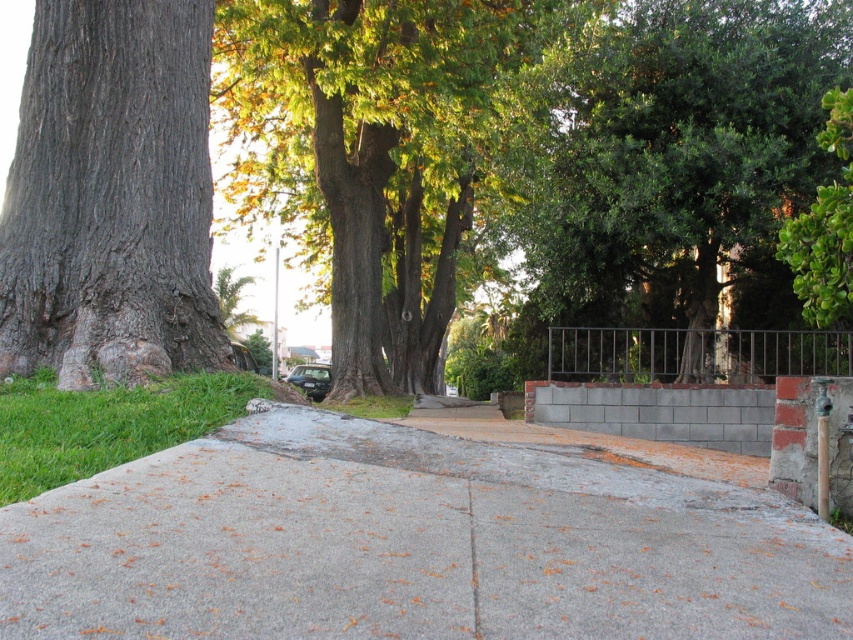
Question: Can you confirm if green leafy tree at center is positioned below green grass at lower left?

Choices:
 (A) yes
 (B) no

Answer: (B)

Question: Does gray concrete pavement at center appear under brown rough bark tree at left?

Choices:
 (A) yes
 (B) no

Answer: (A)

Question: Among these points, which one is nearest to the camera?

Choices:
 (A) (601, 400)
 (B) (125, 403)

Answer: (B)

Question: Based on their relative distances, which object is nearer to the green leafy tree at center?

Choices:
 (A) gray concrete curb at center
 (B) green grass at center
 (C) brown rough bark tree at left

Answer: (B)

Question: Is green leafy tree at right bigger than green grass at lower left?

Choices:
 (A) no
 (B) yes

Answer: (A)

Question: Which of the following is the closest to the observer?

Choices:
 (A) gray concrete pavement at center
 (B) brown rough bark tree at left

Answer: (A)